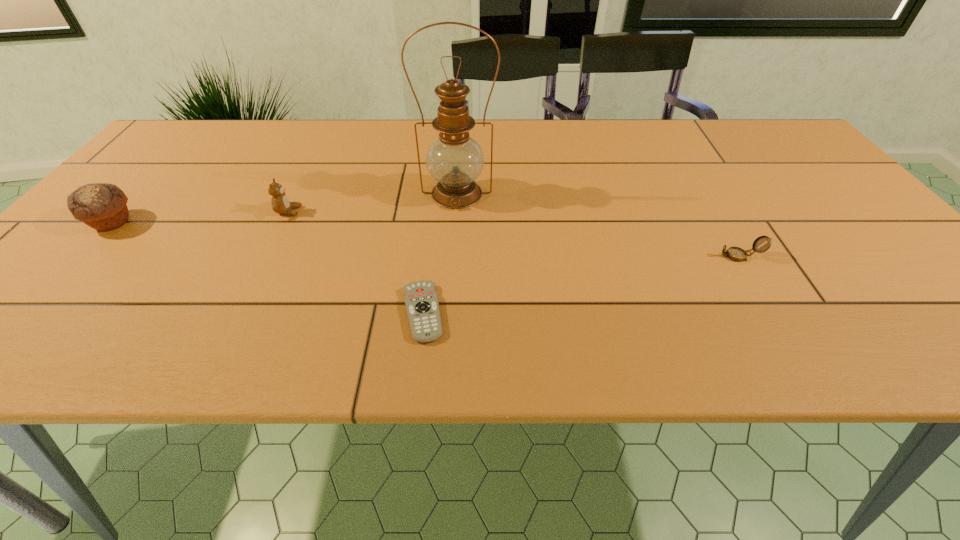
Identify the location of blank space located 0.190m on the front-facing side of the second object from left to right. (381, 211).

You are a GUI agent. You are given a task and a screenshot of the screen. Output one action in this format:
    pyautogui.click(x=<x>, y=<y>)
    Task: Click on the free space located 0.280m on the face of the fourth tallest object
    
    Given the screenshot: What is the action you would take?
    pyautogui.click(x=585, y=256)

Where is `free location located 0.360m on the face of the fourth tallest object`? The image size is (960, 540). free location located 0.360m on the face of the fourth tallest object is located at coordinates (547, 256).

Locate an element on the screen. vacant space positioned 0.350m on the face of the fourth tallest object is located at coordinates (552, 256).

Image resolution: width=960 pixels, height=540 pixels. Find the location of `vacant region located on the left of the nearest object`. vacant region located on the left of the nearest object is located at coordinates (288, 313).

The width and height of the screenshot is (960, 540). I want to click on object located in the near edge section of the desktop, so click(421, 301).

Locate an element on the screen. object present at the left edge is located at coordinates pos(102,206).

In the image, there is a desktop. Where is `vacant region at the far edge`? Image resolution: width=960 pixels, height=540 pixels. vacant region at the far edge is located at coordinates (505, 120).

Find the location of `vacant space at the near edge of the desktop`. vacant space at the near edge of the desktop is located at coordinates (84, 323).

In the image, there is a desktop. Identify the location of blank space at the left edge. (68, 320).